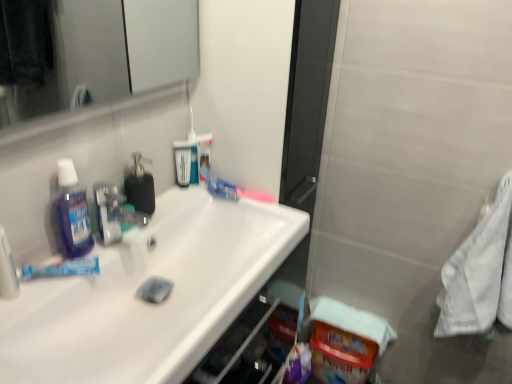
What is the approximate width of translucent purple mouthwash at left, the 1th mouthwash from the front?

translucent purple mouthwash at left, the 1th mouthwash from the front, is 2.01 inches wide.

Identify the location of white glossy sink at upper left. (148, 303).

Measure the distance between blue glossy mouthwash at upper center, which is counted as the 2th mouthwash, starting from the back, and camera.

blue glossy mouthwash at upper center, which is counted as the 2th mouthwash, starting from the back, is 1.24 meters from camera.

Identify the location of blue glossy mouthwash at upper center, the 2th mouthwash viewed from the right. The image size is (512, 384). (182, 162).

Find the location of a particular element. Image resolution: width=512 pixels, height=384 pixels. pink plastic toothbrush at upper center, marked as the second toothbrush in a left-to-right arrangement is located at coordinates (234, 192).

Identify the location of blue matte toothpaste at left. Image resolution: width=512 pixels, height=384 pixels. point(61,269).

How much space does blue glossy mouthwash at upper center, which is the 1th mouthwash from back to front, occupy vertically?

→ blue glossy mouthwash at upper center, which is the 1th mouthwash from back to front, is 16.29 centimeters in height.

At what (x,y) coordinates should I click in order to perform the action: click on translucent purple mouthwash at left, marked as the 3th mouthwash in a right-to-left arrangement. Please return your answer as a coordinate pair (x, y). Looking at the image, I should click on (72, 213).

Is translucent plastic toothbrush at upper center, which is counted as the 2th toothbrush, starting from the bottom, in front of or behind black rubber soap dispenser at center in the image?

In the image, translucent plastic toothbrush at upper center, which is counted as the 2th toothbrush, starting from the bottom, appears behind black rubber soap dispenser at center.

Can you tell me how much translucent plastic toothbrush at upper center, which is counted as the 2th toothbrush, starting from the bottom, and black rubber soap dispenser at center differ in facing direction?

They differ by 8.81 degrees in their facing directions.

Where is `soap dispenser below the translucent plastic toothbrush at upper center, placed as the 1th toothbrush when sorted from top to bottom (from a real-world perspective)`? The image size is (512, 384). soap dispenser below the translucent plastic toothbrush at upper center, placed as the 1th toothbrush when sorted from top to bottom (from a real-world perspective) is located at coordinates (139, 185).

Considering the relative positions of translucent plastic toothbrush at upper center, which is counted as the 2th toothbrush, starting from the bottom, and black rubber soap dispenser at center in the image provided, is translucent plastic toothbrush at upper center, which is counted as the 2th toothbrush, starting from the bottom, to the left or to the right of black rubber soap dispenser at center?

Clearly, translucent plastic toothbrush at upper center, which is counted as the 2th toothbrush, starting from the bottom, is on the right of black rubber soap dispenser at center in the image.

Is point (71, 255) closer to camera compared to point (149, 200)?

Yes, it is.

Looking at the image, does translucent purple mouthwash at left, marked as the 3th mouthwash in a right-to-left arrangement, seem bigger or smaller compared to black rubber soap dispenser at center?

Considering their sizes, translucent purple mouthwash at left, marked as the 3th mouthwash in a right-to-left arrangement, takes up more space than black rubber soap dispenser at center.

From a real-world perspective, is translucent purple mouthwash at left, the 1th mouthwash from the front, below black rubber soap dispenser at center?

No, from a real-world perspective, translucent purple mouthwash at left, the 1th mouthwash from the front, is not below black rubber soap dispenser at center.

Can we say translucent purple mouthwash at left, positioned as the 3th mouthwash in back-to-front order, lies outside black rubber soap dispenser at center?

Absolutely, translucent purple mouthwash at left, positioned as the 3th mouthwash in back-to-front order, is external to black rubber soap dispenser at center.

The height and width of the screenshot is (384, 512). Identify the location of toothbrush behind the blue glossy mouthwash at upper center, which appears as the second mouthwash when viewed from the left. (234, 192).

Consider the image. From a real-world perspective, is blue glossy mouthwash at upper center, which appears as the second mouthwash when viewed from the left, positioned over pink plastic toothbrush at upper center, the first toothbrush in the right-to-left sequence, based on gravity?

Yes, from a real-world perspective, blue glossy mouthwash at upper center, which appears as the second mouthwash when viewed from the left, is above pink plastic toothbrush at upper center, the first toothbrush in the right-to-left sequence.

Is pink plastic toothbrush at upper center, arranged as the first toothbrush when ordered from the bottom, completely or partially inside blue glossy mouthwash at upper center, the 2th mouthwash viewed from the right?

Actually, pink plastic toothbrush at upper center, arranged as the first toothbrush when ordered from the bottom, is outside blue glossy mouthwash at upper center, the 2th mouthwash viewed from the right.

Is blue glossy mouthwash at upper center, the 2th mouthwash positioned from the front, smaller than pink plastic toothbrush at upper center, the first toothbrush in the right-to-left sequence?

Correct, blue glossy mouthwash at upper center, the 2th mouthwash positioned from the front, occupies less space than pink plastic toothbrush at upper center, the first toothbrush in the right-to-left sequence.

Looking at this image, is white glossy sink at upper left closer to the viewer compared to blue matte toothpaste at left?

That is True.

Looking at this image, can you confirm if white glossy sink at upper left is taller than blue matte toothpaste at left?

Indeed, white glossy sink at upper left has a greater height compared to blue matte toothpaste at left.

From the image's perspective, is white glossy sink at upper left over blue matte toothpaste at left?

No.

Between black rubber soap dispenser at center and white textured towel at right, which one is positioned in front?

white textured towel at right is more forward.

Which is farther from the camera, (133,160) or (465,294)?

The point (465,294) is more distant.

Between black rubber soap dispenser at center and white textured towel at right, which one has smaller size?

black rubber soap dispenser at center.

Can you confirm if black rubber soap dispenser at center is thinner than pink plastic toothbrush at upper center, marked as the second toothbrush in a left-to-right arrangement?

No.

In the scene shown: Which of these two, black rubber soap dispenser at center or pink plastic toothbrush at upper center, marked as the second toothbrush in a left-to-right arrangement, is smaller?

pink plastic toothbrush at upper center, marked as the second toothbrush in a left-to-right arrangement, is smaller.

Which is in front, point (141, 154) or point (266, 198)?

Point (141, 154)

Is black rubber soap dispenser at center directly adjacent to pink plastic toothbrush at upper center, the first toothbrush in the right-to-left sequence?

No, black rubber soap dispenser at center is not touching pink plastic toothbrush at upper center, the first toothbrush in the right-to-left sequence.

Who is smaller, blue glossy mouthwash at upper center, the 2th mouthwash positioned from the front, or white glossy sink at upper left?

blue glossy mouthwash at upper center, the 2th mouthwash positioned from the front.

From a real-world perspective, which object stands above the other?

blue glossy mouthwash at upper center, the 2th mouthwash positioned from the front.

Consider the image. Does blue glossy mouthwash at upper center, the 2th mouthwash viewed from the right, appear on the left side of white glossy sink at upper left?

Yes, blue glossy mouthwash at upper center, the 2th mouthwash viewed from the right, is to the left of white glossy sink at upper left.

The height and width of the screenshot is (384, 512). In order to click on soap dispenser that appears below the translucent plastic toothbrush at upper center, placed as the second toothbrush when sorted from right to left (from a real-world perspective) in this screenshot , I will do `click(139, 185)`.

I want to click on mouthwash located in front of the black rubber soap dispenser at center, so click(72, 213).

Consider the image. Looking at the image, which one is located further to translucent plastic toothbrush at upper center, which is counted as the 2th toothbrush, starting from the bottom, blue glossy mouthwash at upper center, which ranks as the first mouthwash in right-to-left order, or white textured towel at right?

white textured towel at right is further to translucent plastic toothbrush at upper center, which is counted as the 2th toothbrush, starting from the bottom.

Based on their spatial positions, is blue matte toothpaste at left or pink plastic toothbrush at upper center, the 2th toothbrush from the top, closer to translucent purple mouthwash at left, positioned as the 3th mouthwash in back-to-front order?

The object closer to translucent purple mouthwash at left, positioned as the 3th mouthwash in back-to-front order, is blue matte toothpaste at left.

Based on their spatial positions, is translucent plastic toothbrush at upper center, which is counted as the 2th toothbrush, starting from the bottom, or translucent purple mouthwash at left, marked as the first mouthwash in a left-to-right arrangement, closer to pink plastic toothbrush at upper center, marked as the second toothbrush in a left-to-right arrangement?

translucent plastic toothbrush at upper center, which is counted as the 2th toothbrush, starting from the bottom.

When comparing their distances from blue matte toothpaste at left, does translucent purple mouthwash at left, marked as the first mouthwash in a left-to-right arrangement, or translucent plastic toothbrush at upper center, which is counted as the 2th toothbrush, starting from the bottom, seem further?

The object further to blue matte toothpaste at left is translucent plastic toothbrush at upper center, which is counted as the 2th toothbrush, starting from the bottom.

Estimate the real-world distances between objects in this image. Which object is closer to translucent purple mouthwash at left, the 1th mouthwash from the front, blue matte toothpaste at left or white glossy sink at upper left?

blue matte toothpaste at left lies closer to translucent purple mouthwash at left, the 1th mouthwash from the front, than the other object.

Which object lies further to the anchor point black rubber soap dispenser at center, blue glossy mouthwash at upper center, which ranks as the first mouthwash in right-to-left order, or white textured towel at right?

white textured towel at right.

Estimate the real-world distances between objects in this image. Which object is closer to blue matte toothpaste at left, blue glossy mouthwash at upper center, the third mouthwash viewed from the left, or translucent purple mouthwash at left, marked as the first mouthwash in a left-to-right arrangement?

translucent purple mouthwash at left, marked as the first mouthwash in a left-to-right arrangement.

When comparing their distances from translucent purple mouthwash at left, the 1th mouthwash from the front, does blue glossy mouthwash at upper center, the 2th mouthwash viewed from the right, or white textured towel at right seem closer?

blue glossy mouthwash at upper center, the 2th mouthwash viewed from the right, lies closer to translucent purple mouthwash at left, the 1th mouthwash from the front, than the other object.

Where is `mouthwash located between blue glossy mouthwash at upper center, which is counted as the 2th mouthwash, starting from the back, and pink plastic toothbrush at upper center, the 2th toothbrush from the top, in the left-right direction`? The width and height of the screenshot is (512, 384). mouthwash located between blue glossy mouthwash at upper center, which is counted as the 2th mouthwash, starting from the back, and pink plastic toothbrush at upper center, the 2th toothbrush from the top, in the left-right direction is located at coordinates (204, 155).

The width and height of the screenshot is (512, 384). In order to click on toothbrush between blue matte toothpaste at left and pink plastic toothbrush at upper center, arranged as the first toothbrush when ordered from the bottom, in the front-back direction in this screenshot , I will do `click(192, 142)`.

Locate an element on the screen. The image size is (512, 384). soap dispenser between blue matte toothpaste at left and white textured towel at right is located at coordinates (139, 185).

Locate an element on the screen. The image size is (512, 384). toothbrush located between translucent purple mouthwash at left, positioned as the 3th mouthwash in back-to-front order, and pink plastic toothbrush at upper center, the first toothbrush in the right-to-left sequence, in the depth direction is located at coordinates (192, 142).